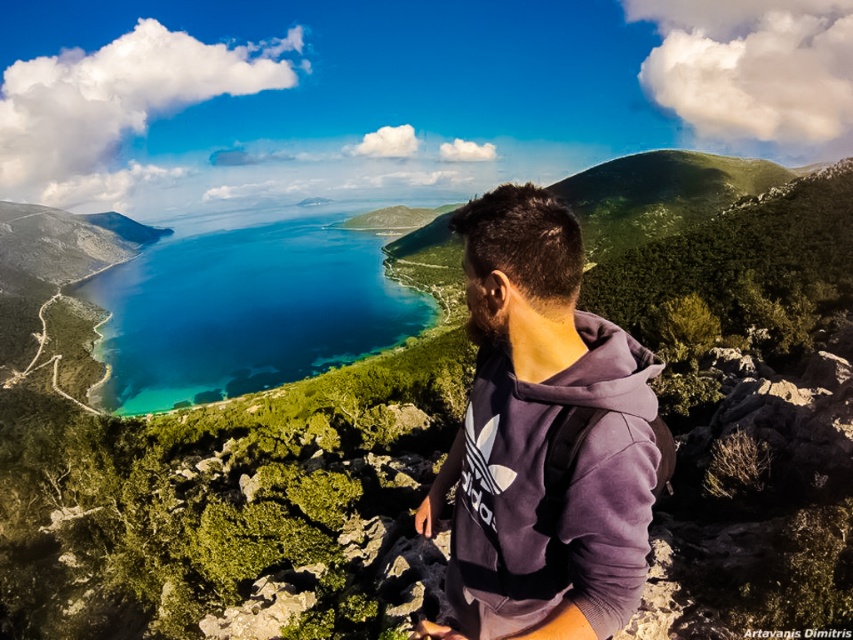
You are a hiker who wants to take a photo of the purple fleece jacket at center from the highest point in the scene. Where should you position yourself to get the best shot?

The purple fleece jacket at center is located at point (543, 438) in the scene. To capture it from the highest point, position yourself at the highest elevation available, likely the rocky outcrop where the person is standing, ensuring the jacket remains centered in your viewfinder.

You are standing at the edge of the cliff looking out at the bay. There is a point marked at coordinates (543, 438). What object is located at that point?

The point at coordinates (543, 438) indicates the purple fleece jacket at center.